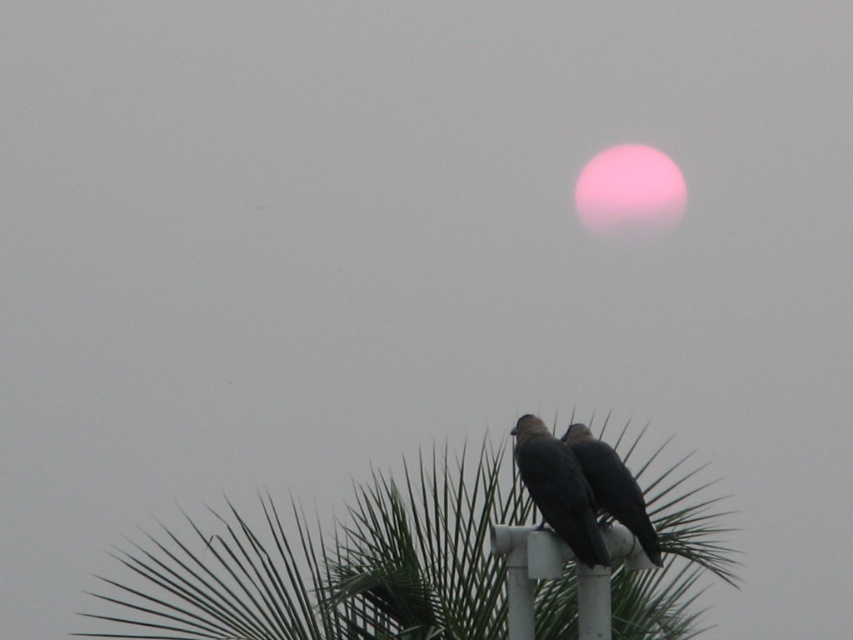
The width and height of the screenshot is (853, 640). What do you see at coordinates (438, 561) in the screenshot? I see `green leafy tree at center` at bounding box center [438, 561].

Between point (486, 493) and point (573, 513), which one is positioned in front?

Point (573, 513) is in front.

I want to click on green leafy tree at center, so click(438, 561).

Is dark gray feathers at center wider than shiny black bird at center?

Incorrect, dark gray feathers at center's width does not surpass shiny black bird at center's.

Can you confirm if dark gray feathers at center is bigger than shiny black bird at center?

Correct, dark gray feathers at center is larger in size than shiny black bird at center.

Which is behind, point (543, 513) or point (611, 506)?

The point (611, 506) is more distant.

You are a GUI agent. You are given a task and a screenshot of the screen. Output one action in this format:
    pyautogui.click(x=<x>, y=<y>)
    Task: Click on the dark gray feathers at center
    
    Given the screenshot: What is the action you would take?
    pyautogui.click(x=558, y=490)

Looking at this image, who is more forward, (219, 602) or (611, 458)?

Positioned in front is point (611, 458).

Identify the location of green leafy tree at center. The width and height of the screenshot is (853, 640). (438, 561).